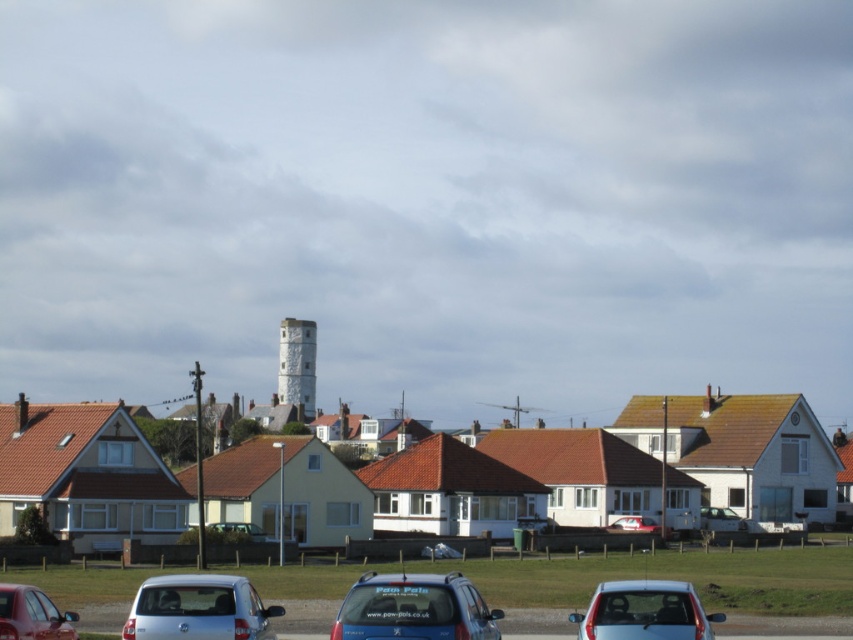
Question: Can you confirm if matte red car at lower left is smaller than metallic red car at center?

Choices:
 (A) yes
 (B) no

Answer: (B)

Question: Which of the following is the farthest from the observer?

Choices:
 (A) (740, 528)
 (B) (102, 576)
 (C) (466, 632)
 (D) (244, 611)

Answer: (A)

Question: Which object is farther from the camera taking this photo?

Choices:
 (A) satin silver car at lower left
 (B) metallic silver car at center
 (C) metallic red car at center

Answer: (C)

Question: Is satin silver car at lower left thinner than white matte car at lower right?

Choices:
 (A) no
 (B) yes

Answer: (A)

Question: Which of the following is the farthest from the observer?

Choices:
 (A) (381, 625)
 (B) (44, 637)
 (C) (294, 336)
 (D) (323, 618)

Answer: (C)

Question: Can you confirm if satin silver car at lower left is positioned to the right of white textured tower at center?

Choices:
 (A) no
 (B) yes

Answer: (B)